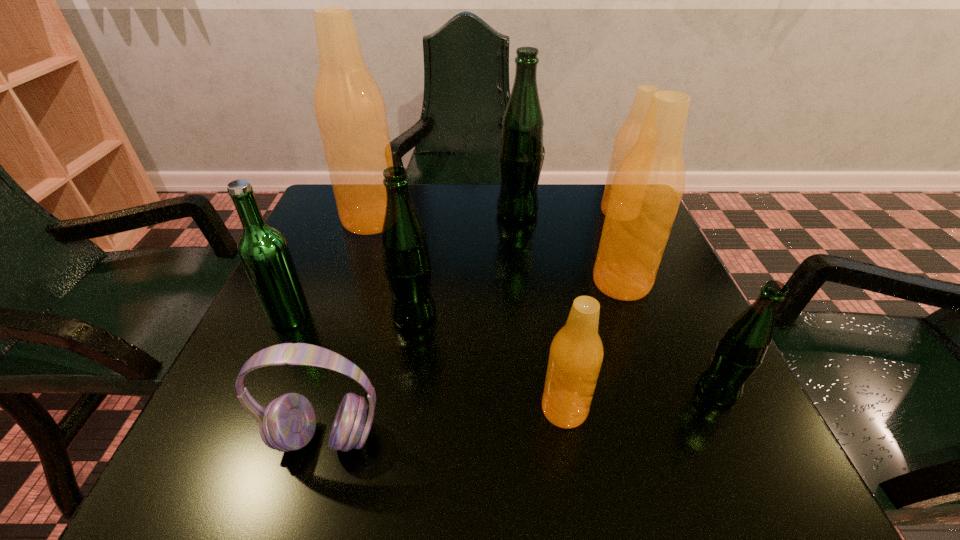
This screenshot has height=540, width=960. I want to click on free area in between the leftmost green beer bottle and the nearest tan beer bottle, so click(x=427, y=363).

This screenshot has width=960, height=540. In order to click on vacant point located between the tallest object and the third farthest tan beer bottle in this screenshot , I will do `click(496, 251)`.

Locate an element on the screen. This screenshot has height=540, width=960. empty location between the biggest green beer bottle and the third beer bottle from left to right is located at coordinates (466, 264).

Find the location of a particular element. The height and width of the screenshot is (540, 960). object identified as the second closest to the tallest object is located at coordinates (263, 250).

Identify which object is the fourth nearest to the second green beer bottle from left to right. Please provide its 2D coordinates. Your answer should be formatted as a tuple, i.e. [(x, y)], where the tuple contains the x and y coordinates of a point satisfying the conditions above.

[(349, 108)]

This screenshot has width=960, height=540. In order to click on beer bottle that can be found as the closest to the third farthest tan beer bottle in this screenshot , I will do (627, 134).

The width and height of the screenshot is (960, 540). I want to click on beer bottle that is the sixth nearest to the third biggest tan beer bottle, so click(576, 354).

The height and width of the screenshot is (540, 960). Identify the location of tan beer bottle that can be found as the second closest to the rightmost green beer bottle. (576, 354).

Locate an element on the screen. Image resolution: width=960 pixels, height=540 pixels. the closest tan beer bottle to the headset is located at coordinates (576, 354).

Image resolution: width=960 pixels, height=540 pixels. What are the coordinates of `green beer bottle that stands as the closest to the headset` in the screenshot? It's located at (406, 260).